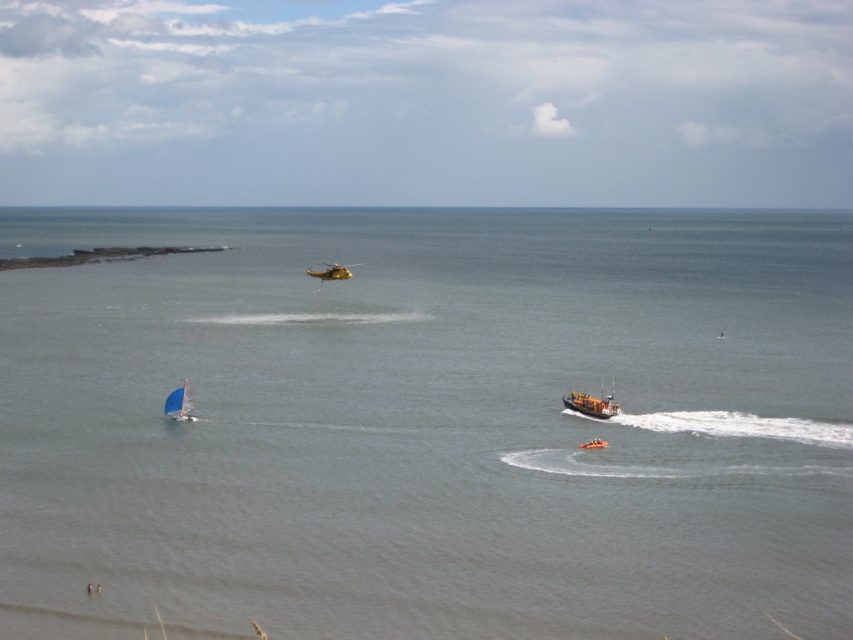
You are a marine biologist studying underwater ecosystems. You are currently at the point with coordinates point [100,256]. What is the nearest underwater structure you can explore?

The point [100,256] corresponds to the brown coral reef at upper left, so the nearest underwater structure you can explore is the brown coral reef at upper left.

You are a marine biologist observing the coastal scene. You need to determine which object is taller between the brown coral reef at upper left and the orange metallic lifeboat at center. Based on the scene, which one is taller?

The brown coral reef at upper left is taller than the orange metallic lifeboat at center.